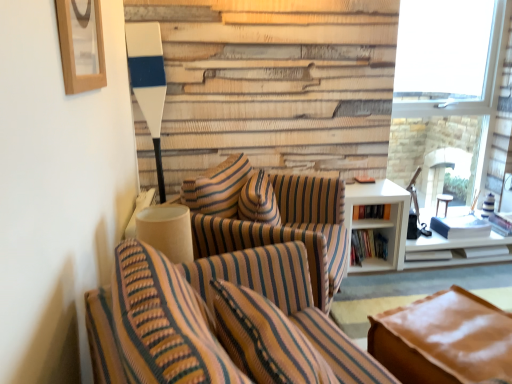
The width and height of the screenshot is (512, 384). Describe the element at coordinates (81, 45) in the screenshot. I see `wooden picture frame at upper left` at that location.

Locate an element on the screen. The image size is (512, 384). hardcover books at right, the first book in the top-to-bottom sequence is located at coordinates (371, 211).

The width and height of the screenshot is (512, 384). Describe the element at coordinates (454, 90) in the screenshot. I see `white matte window at upper right` at that location.

This screenshot has height=384, width=512. I want to click on striped fabric chair at center, the 2th chair when ordered from back to front, so click(x=219, y=322).

The width and height of the screenshot is (512, 384). What do you see at coordinates (367, 246) in the screenshot?
I see `hardcover books at right, the first book when ordered from bottom to top` at bounding box center [367, 246].

What are the coordinates of `white matte table lamp at left` in the screenshot? It's located at (167, 230).

Can you confirm if wooden table at right is bigger than striped fabric chair at center, the 2th chair when ordered from back to front?

Actually, wooden table at right might be smaller than striped fabric chair at center, the 2th chair when ordered from back to front.

Is wooden table at right next to striped fabric chair at center, arranged as the 1th chair when viewed from the front?

wooden table at right and striped fabric chair at center, arranged as the 1th chair when viewed from the front, are clearly separated.

Can you confirm if wooden table at right is positioned to the left of striped fabric chair at center, the 2th chair when ordered from back to front?

No, wooden table at right is not to the left of striped fabric chair at center, the 2th chair when ordered from back to front.

At what (x,y) coordinates should I click in order to perform the action: click on the 2nd chair in front of the wooden table at right. Please return your answer as a coordinate pair (x, y). Image resolution: width=512 pixels, height=384 pixels. Looking at the image, I should click on 219,322.

This screenshot has width=512, height=384. In order to click on picture frame behind the striped fabric chair at center, arranged as the 1th chair when viewed from the front in this screenshot , I will do `click(81, 45)`.

Is the position of striped fabric chair at center, arranged as the 1th chair when viewed from the front, more distant than that of wooden picture frame at upper left?

That is False.

Between striped fabric chair at center, arranged as the 1th chair when viewed from the front, and wooden picture frame at upper left, which one has larger width?

striped fabric chair at center, arranged as the 1th chair when viewed from the front.

Considering the points (446, 290) and (329, 181), which point is behind, point (446, 290) or point (329, 181)?

The point (329, 181) is behind.

Can you confirm if brown leather couch at lower right is positioned to the right of striped fabric chair at center, which appears as the first chair when viewed from the back?

Correct, you'll find brown leather couch at lower right to the right of striped fabric chair at center, which appears as the first chair when viewed from the back.

Is brown leather couch at lower right next to striped fabric chair at center, which appears as the first chair when viewed from the back?

brown leather couch at lower right and striped fabric chair at center, which appears as the first chair when viewed from the back, are clearly separated.

Is brown leather couch at lower right inside or outside of striped fabric chair at center, which appears as the first chair when viewed from the back?

The correct answer is: outside.

From a real-world perspective, is hardcover books at right, which is the second book from bottom to top, over wooden table at right?

Yes.

From the image's perspective, is hardcover books at right, which is the second book from bottom to top, positioned above or below wooden table at right?

From the image's perspective, hardcover books at right, which is the second book from bottom to top, appears above wooden table at right.

Is hardcover books at right, which is the second book from bottom to top, not inside wooden table at right?

Indeed, hardcover books at right, which is the second book from bottom to top, is completely outside wooden table at right.

Considering the positions of points (369, 209) and (441, 200), is point (369, 209) closer to camera compared to point (441, 200)?

Yes, it is in front of point (441, 200).

Is wooden picture frame at upper left shorter than white matte table lamp at left?

No, wooden picture frame at upper left is not shorter than white matte table lamp at left.

This screenshot has height=384, width=512. Find the location of `table lamp that is under the wooden picture frame at upper left (from a real-world perspective)`. table lamp that is under the wooden picture frame at upper left (from a real-world perspective) is located at coordinates (167, 230).

Is wooden picture frame at upper left spatially inside white matte table lamp at left, or outside of it?

wooden picture frame at upper left cannot be found inside white matte table lamp at left.

From a real-world perspective, which object rests below the other?

In real-world perspective, white matte table lamp at left is lower.

Is striped fabric chair at center, the 2th chair when ordered from back to front, further to camera compared to striped fabric chair at center, which appears as the first chair when viewed from the back?

No, the depth of striped fabric chair at center, the 2th chair when ordered from back to front, is less than that of striped fabric chair at center, which appears as the first chair when viewed from the back.

Considering the sizes of objects striped fabric chair at center, the 2th chair when ordered from back to front, and striped fabric chair at center, which appears as the first chair when viewed from the back, in the image provided, who is thinner, striped fabric chair at center, the 2th chair when ordered from back to front, or striped fabric chair at center, which appears as the first chair when viewed from the back,?

With smaller width is striped fabric chair at center, the 2th chair when ordered from back to front.

Looking at this image, from a real-world perspective, is striped fabric chair at center, the 2th chair when ordered from back to front, physically above striped fabric chair at center, marked as the 2th chair in a front-to-back arrangement?

Yes, from a real-world perspective, striped fabric chair at center, the 2th chair when ordered from back to front, is over striped fabric chair at center, marked as the 2th chair in a front-to-back arrangement

Is wooden table at right positioned before white matte table lamp at left?

No.

You are a GUI agent. You are given a task and a screenshot of the screen. Output one action in this format:
    pyautogui.click(x=<x>, y=<y>)
    Task: Click on the table lamp that is on the left side of wooden table at right
    
    Given the screenshot: What is the action you would take?
    pyautogui.click(x=167, y=230)

Is wooden table at right turned away from white matte table lamp at left?

No, wooden table at right is not facing away from white matte table lamp at left.

Which is more to the right, wooden table at right or white matte table lamp at left?

wooden table at right.

This screenshot has width=512, height=384. In order to click on table below the striped fabric chair at center, the 2th chair when ordered from back to front (from a real-world perspective) in this screenshot , I will do `click(443, 201)`.

In order to click on the 2nd chair below when counting from the wooden picture frame at upper left (from the image's perspective) in this screenshot , I will do `click(219, 322)`.

From the image, which object appears to be farther from wooden table at right, striped fabric chair at center, which appears as the first chair when viewed from the back, or brown leather couch at lower right?

Among the two, brown leather couch at lower right is located further to wooden table at right.

From the picture: Estimate the real-world distances between objects in this image. Which object is further from hardcover books at right, which is the second book from top to bottom, brown leather couch at lower right or striped fabric chair at center, the 2th chair when ordered from back to front?

Based on the image, striped fabric chair at center, the 2th chair when ordered from back to front, appears to be further to hardcover books at right, which is the second book from top to bottom.

When comparing their distances from wooden table at right, does white matte window at upper right or hardcover books at right, which is the second book from bottom to top, seem further?

white matte window at upper right lies further to wooden table at right than the other object.

When comparing their distances from striped fabric chair at center, marked as the 2th chair in a front-to-back arrangement, does wooden picture frame at upper left or white matte window at upper right seem closer?

wooden picture frame at upper left lies closer to striped fabric chair at center, marked as the 2th chair in a front-to-back arrangement, than the other object.

Looking at the image, which one is located closer to wooden table at right, white matte table lamp at left or white matte window at upper right?

white matte window at upper right lies closer to wooden table at right than the other object.

Based on their spatial positions, is hardcover books at right, which is the second book from top to bottom, or wooden table at right closer to white matte window at upper right?

wooden table at right is positioned closer to the anchor white matte window at upper right.

Estimate the real-world distances between objects in this image. Which object is further from wooden table at right, hardcover books at right, the first book in the top-to-bottom sequence, or striped fabric chair at center, marked as the 2th chair in a front-to-back arrangement?

striped fabric chair at center, marked as the 2th chair in a front-to-back arrangement, is further to wooden table at right.

From the image, which object appears to be nearer to wooden table at right, hardcover books at right, the first book in the top-to-bottom sequence, or striped fabric chair at center, arranged as the 1th chair when viewed from the front?

Among the two, hardcover books at right, the first book in the top-to-bottom sequence, is located nearer to wooden table at right.

Locate an element on the screen. The image size is (512, 384). picture frame between striped fabric chair at center, the 2th chair when ordered from back to front, and hardcover books at right, the first book in the top-to-bottom sequence, from front to back is located at coordinates (81, 45).

Locate an element on the screen. The width and height of the screenshot is (512, 384). chair positioned between striped fabric chair at center, arranged as the 1th chair when viewed from the front, and white matte window at upper right from near to far is located at coordinates (270, 217).

Identify the location of book between brown leather couch at lower right and hardcover books at right, which is the second book from bottom to top, from front to back. This screenshot has width=512, height=384. (367, 246).

You are a GUI agent. You are given a task and a screenshot of the screen. Output one action in this format:
    pyautogui.click(x=<x>, y=<y>)
    Task: Click on the studio couch located between wooden picture frame at upper left and hardcover books at right, the first book in the top-to-bottom sequence, in the depth direction
    The width and height of the screenshot is (512, 384).
    Given the screenshot: What is the action you would take?
    pyautogui.click(x=444, y=340)